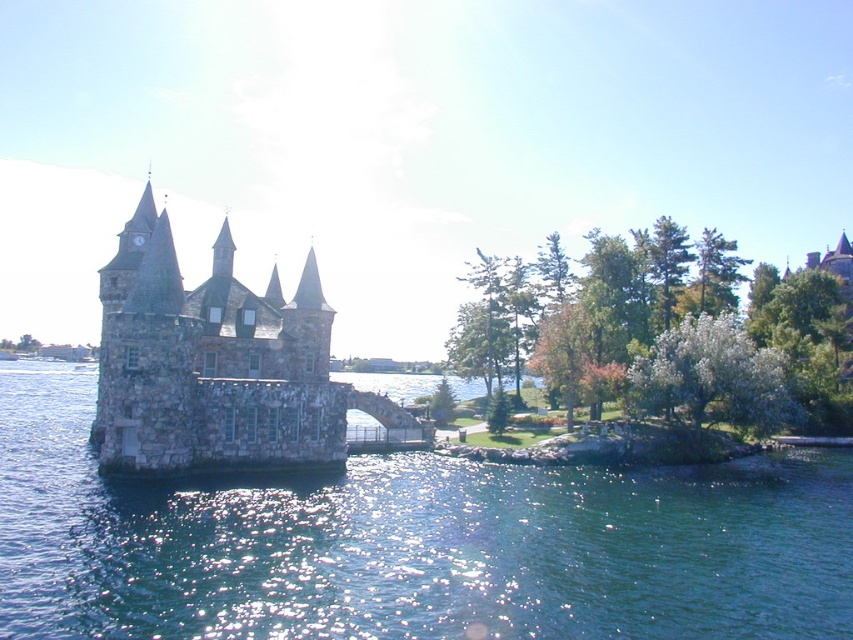
You are standing on the mainland and want to cross the bridge to the castle. There is a clear blue water at center marked by point (410, 544). Can you see the clear blue water at center from your current position on the mainland?

Yes, the clear blue water at center is located at point (410, 544), which is directly in the center of the image. Since you are on the mainland connected by a bridge leading to the castle, you would have a clear line of sight to the center area of the water, so you can see the clear blue water at center from your position.

You are standing on the mainland and want to cross the bridge to reach the stone castle at center. However, there is clear blue water at center between you and the castle. Can you safely walk across the bridge without getting your feet wet?

The clear blue water at center is 14.77 meters away from the stone castle at center, so the distance between them is too large for the water to be in the way of the bridge. You can safely walk across the bridge to the stone castle at center without getting wet.